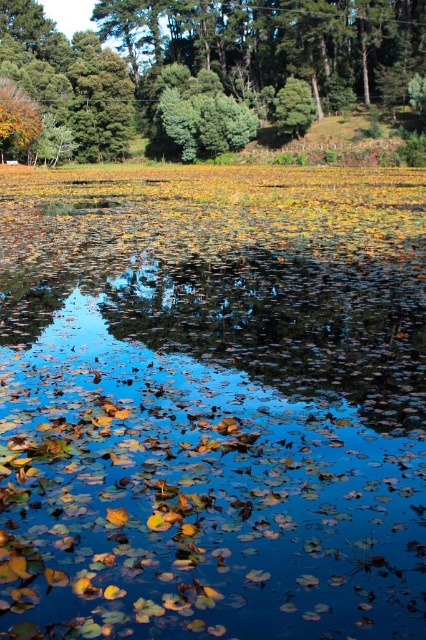
Which of these two, yellow-green leaves at center or green matte tree at upper left, stands shorter?

With less height is yellow-green leaves at center.

Is yellow-green leaves at center above green matte tree at upper left?

Actually, yellow-green leaves at center is below green matte tree at upper left.

What do you see at coordinates (212, 403) in the screenshot?
I see `yellow-green leaves at center` at bounding box center [212, 403].

Where is `yellow-green leaves at center`? Image resolution: width=426 pixels, height=640 pixels. yellow-green leaves at center is located at coordinates pos(212,403).